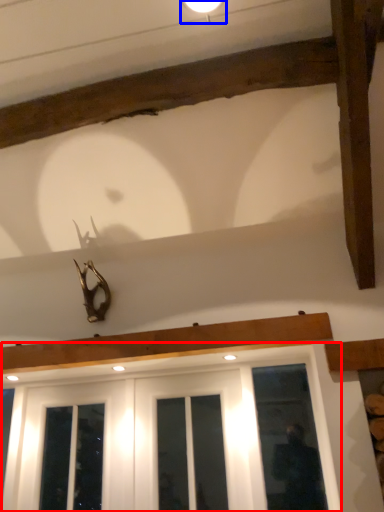
Question: Among these objects, which one is nearest to the camera, window (highlighted by a red box) or light fixture (highlighted by a blue box)?

Choices:
 (A) window
 (B) light fixture

Answer: (B)